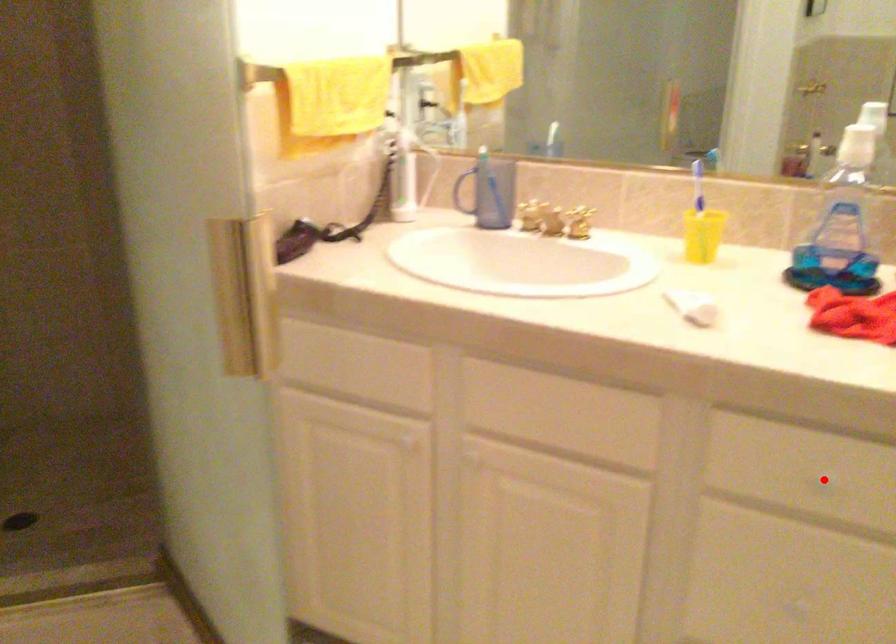
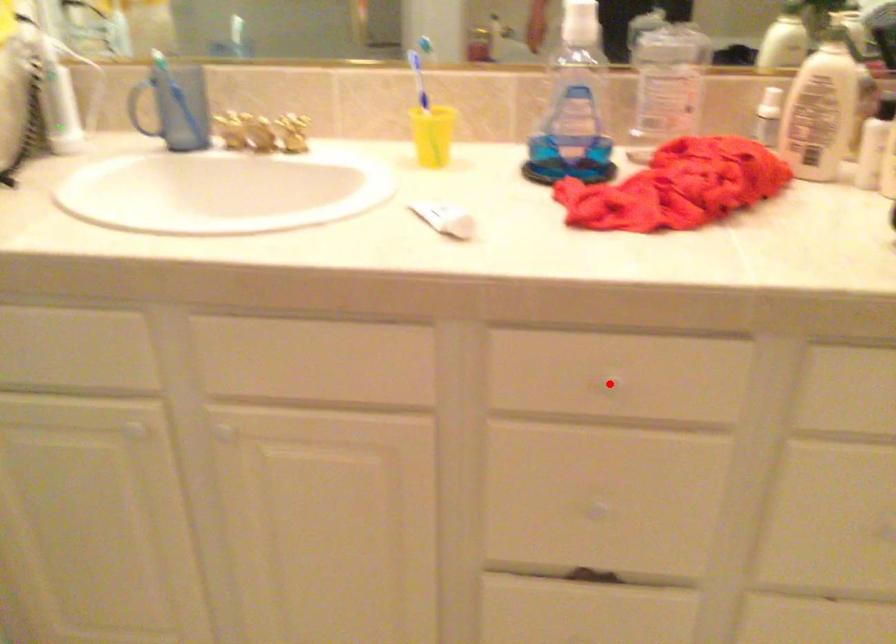
I am providing you with two images of the same scene from different viewpoints. A red point is marked on the first image and another point is marked on the second image. Does the point marked in image1 correspond to the same location as the one in image2?

Yes